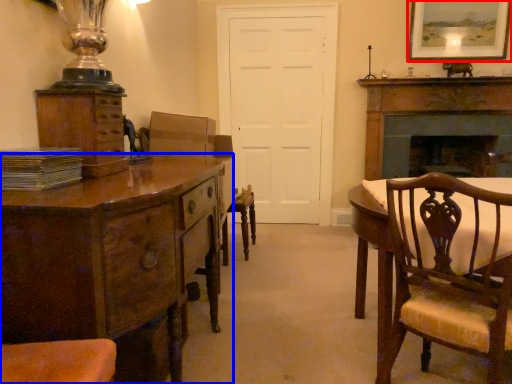
Question: Which point is closer to the camera, picture frame (highlighted by a red box) or chest of drawers (highlighted by a blue box)?

Choices:
 (A) picture frame
 (B) chest of drawers

Answer: (B)